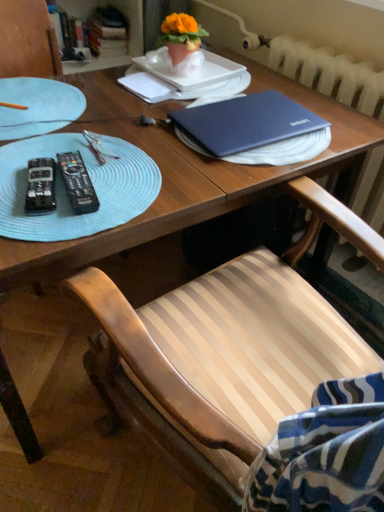
At what (x,y) coordinates should I click in order to perform the action: click on vacant area that is situated to the right of light blue textured glass plate at left, the second glass plate when ordered from bottom to top. Please return your answer as a coordinate pair (x, y). Looking at the image, I should click on (128, 128).